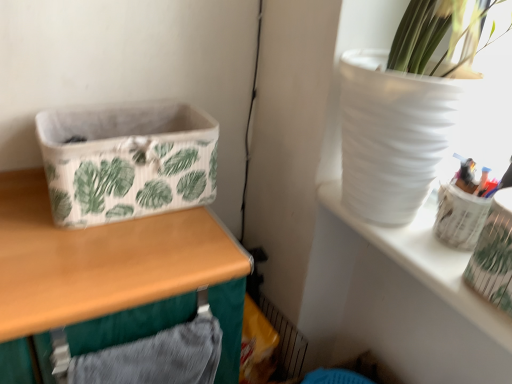
Question: Is translucent plastic pen holder at upper right aimed at white fabric basket at left?

Choices:
 (A) no
 (B) yes

Answer: (A)

Question: From the image's perspective, is translucent plastic pen holder at upper right below white fabric basket at left?

Choices:
 (A) yes
 (B) no

Answer: (A)

Question: Does translucent plastic pen holder at upper right have a greater width compared to white fabric basket at left?

Choices:
 (A) no
 (B) yes

Answer: (A)

Question: Is translucent plastic pen holder at upper right outside white fabric basket at left?

Choices:
 (A) no
 (B) yes

Answer: (B)

Question: From a real-world perspective, does translucent plastic pen holder at upper right stand above white fabric basket at left?

Choices:
 (A) yes
 (B) no

Answer: (A)

Question: Is white fabric basket at left a part of translucent plastic pen holder at upper right?

Choices:
 (A) no
 (B) yes

Answer: (A)

Question: Is white matte vase at upper right positioned in front of white fabric basket at left?

Choices:
 (A) yes
 (B) no

Answer: (A)

Question: From the image's perspective, is white matte vase at upper right on top of white fabric basket at left?

Choices:
 (A) yes
 (B) no

Answer: (B)

Question: Is white matte vase at upper right positioned beyond the bounds of white fabric basket at left?

Choices:
 (A) no
 (B) yes

Answer: (B)

Question: Is the surface of white matte vase at upper right in direct contact with white fabric basket at left?

Choices:
 (A) no
 (B) yes

Answer: (A)

Question: Is white matte vase at upper right turned away from white fabric basket at left?

Choices:
 (A) no
 (B) yes

Answer: (A)

Question: Does white matte vase at upper right come behind white fabric basket at left?

Choices:
 (A) yes
 (B) no

Answer: (B)

Question: From a real-world perspective, is wooden table at left physically below white fabric basket at left?

Choices:
 (A) no
 (B) yes

Answer: (B)